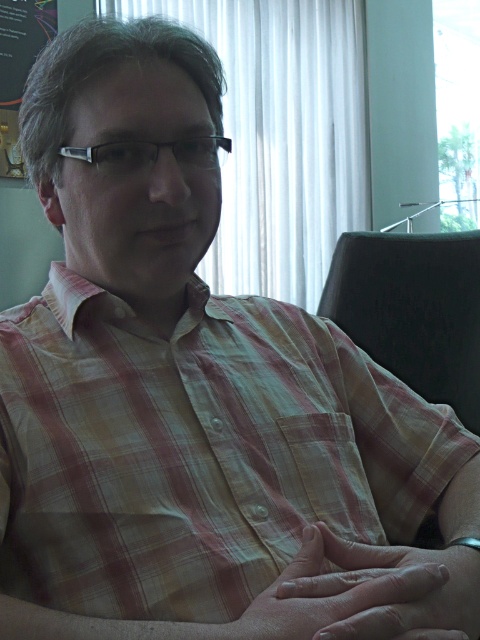
Question: Is black leather chair at right above smooth skin hand at center?

Choices:
 (A) no
 (B) yes

Answer: (B)

Question: Which object is positioned farthest from the black leather chair at right?

Choices:
 (A) silver metallic glasses at center
 (B) smooth skin hand at center

Answer: (B)

Question: Which object appears closest to the camera in this image?

Choices:
 (A) black leather chair at right
 (B) smooth skin hand at center
 (C) silver metallic glasses at center

Answer: (B)

Question: Can you confirm if black leather chair at right is bigger than silver metallic glasses at center?

Choices:
 (A) yes
 (B) no

Answer: (A)

Question: Which object is positioned farthest from the black leather chair at right?

Choices:
 (A) silver metallic glasses at center
 (B) smooth skin hand at center

Answer: (B)

Question: Is black leather chair at right smaller than silver metallic glasses at center?

Choices:
 (A) no
 (B) yes

Answer: (A)